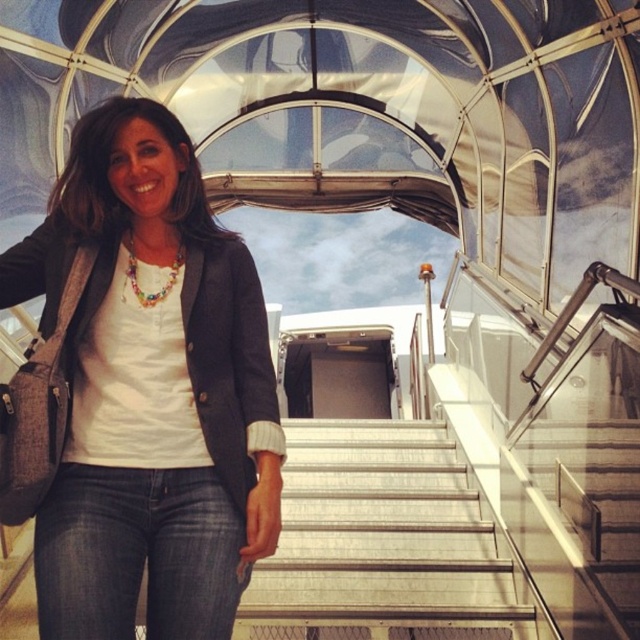
Question: Which of the following is the closest to the observer?

Choices:
 (A) (376, 588)
 (B) (56, 476)

Answer: (B)

Question: Which of these objects is positioned closest to the denim jeans at center?

Choices:
 (A) dark blue denim jeans at lower center
 (B) metallic silver stairs at center

Answer: (A)

Question: Can you confirm if denim jeans at center is positioned to the left of metallic silver stairs at center?

Choices:
 (A) no
 (B) yes

Answer: (B)

Question: Among these objects, which one is farthest from the camera?

Choices:
 (A) dark blue denim jeans at lower center
 (B) metallic silver stairs at center

Answer: (B)

Question: Does metallic silver stairs at center have a greater width compared to dark blue denim jeans at lower center?

Choices:
 (A) yes
 (B) no

Answer: (A)

Question: Is denim jeans at center to the left of metallic silver stairs at center from the viewer's perspective?

Choices:
 (A) yes
 (B) no

Answer: (A)